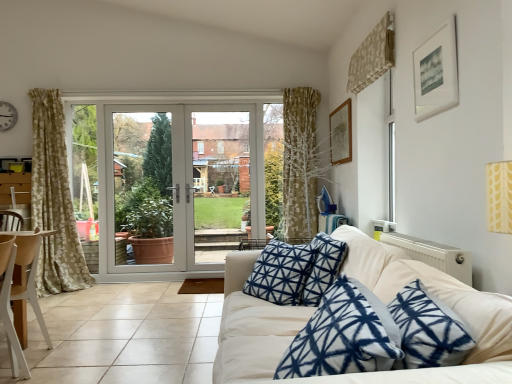
Question: Is white glossy door at center in front of wooden chair at left?

Choices:
 (A) no
 (B) yes

Answer: (A)

Question: From the image's perspective, is white glossy door at center located beneath wooden chair at left?

Choices:
 (A) no
 (B) yes

Answer: (A)

Question: Can you confirm if white glossy door at center is thinner than wooden chair at left?

Choices:
 (A) no
 (B) yes

Answer: (B)

Question: Does white glossy door at center have a lesser height compared to wooden chair at left?

Choices:
 (A) no
 (B) yes

Answer: (A)

Question: Is white glossy door at center positioned with its back to wooden chair at left?

Choices:
 (A) yes
 (B) no

Answer: (B)

Question: In terms of height, does metallic wall clock at upper left look taller or shorter compared to white matte picture frame at upper right, the first picture frame positioned from the front?

Choices:
 (A) tall
 (B) short

Answer: (B)

Question: From a real-world perspective, is metallic wall clock at upper left above or below white matte picture frame at upper right, which is counted as the first picture frame, starting from the right?

Choices:
 (A) below
 (B) above

Answer: (B)

Question: From the image's perspective, is metallic wall clock at upper left above or below white matte picture frame at upper right, the first picture frame positioned from the front?

Choices:
 (A) below
 (B) above

Answer: (B)

Question: Considering the relative positions of metallic wall clock at upper left and white matte picture frame at upper right, the first picture frame positioned from the front, in the image provided, is metallic wall clock at upper left to the left or to the right of white matte picture frame at upper right, the first picture frame positioned from the front,?

Choices:
 (A) left
 (B) right

Answer: (A)

Question: Considering the positions of white glossy door at center and wooden picture frame at upper right, the first picture frame viewed from the left, in the image, is white glossy door at center taller or shorter than wooden picture frame at upper right, the first picture frame viewed from the left,?

Choices:
 (A) short
 (B) tall

Answer: (B)

Question: Is white glossy door at center wider or thinner than wooden picture frame at upper right, placed as the second picture frame when sorted from front to back?

Choices:
 (A) wide
 (B) thin

Answer: (A)

Question: Is white glossy door at center bigger or smaller than wooden picture frame at upper right, which is the 1th picture frame in back-to-front order?

Choices:
 (A) small
 (B) big

Answer: (B)

Question: Would you say white glossy door at center is to the left or to the right of wooden picture frame at upper right, placed as the second picture frame when sorted from front to back, in the picture?

Choices:
 (A) right
 (B) left

Answer: (B)

Question: In the image, is white plastic screen door at center, positioned as the 2th screen door in left-to-right order, on the left side or the right side of white glossy door at center, acting as the second screen door starting from the right?

Choices:
 (A) left
 (B) right

Answer: (B)

Question: From a real-world perspective, relative to white glossy door at center, acting as the second screen door starting from the right, is white plastic screen door at center, the first screen door positioned from the right, vertically above or below?

Choices:
 (A) below
 (B) above

Answer: (A)